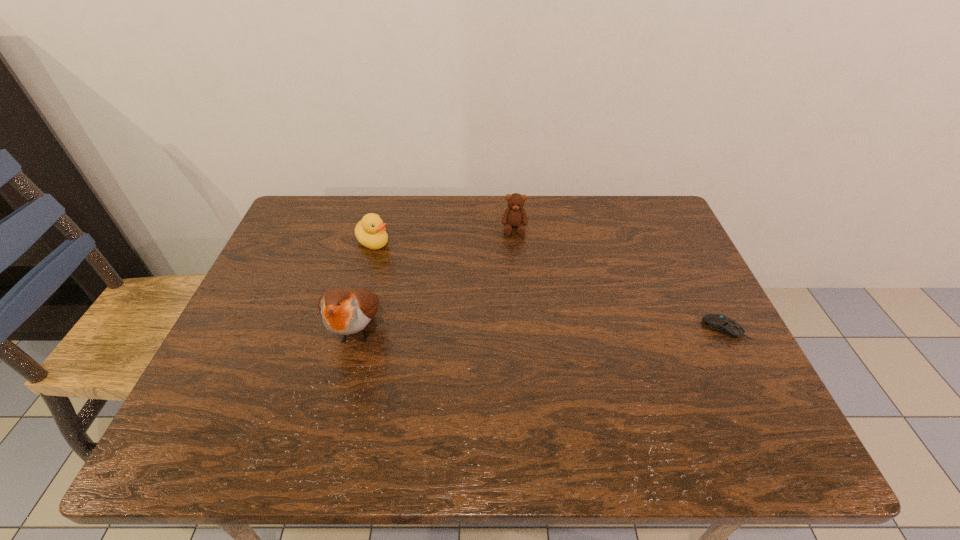
I want to click on vacant space on the desktop that is between the bird and the rightmost object and is positioned on the face of the duckling, so coord(504,330).

Identify the location of vacant spot on the desktop that is between the tallest object and the shortest object and is positioned on the face of the second object from right to left. (514, 329).